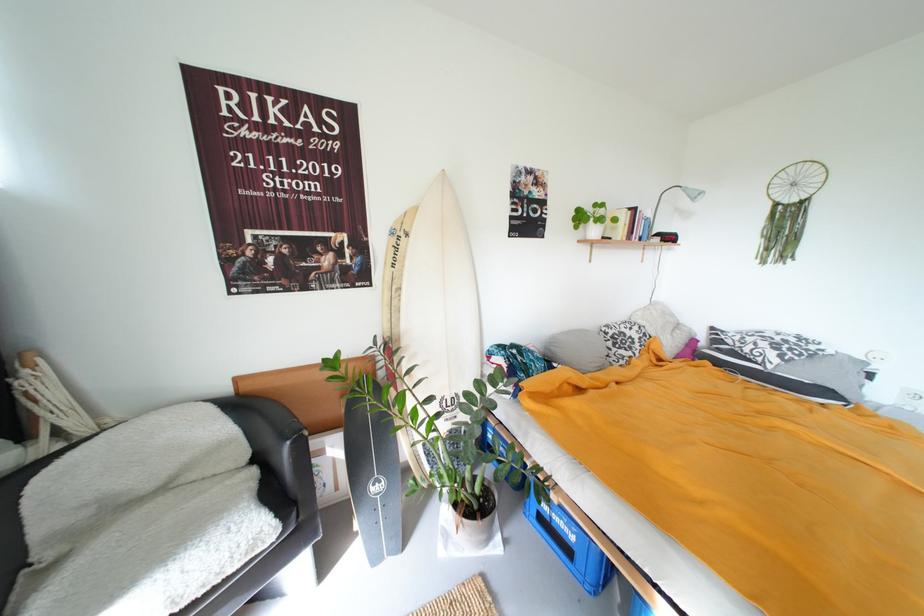
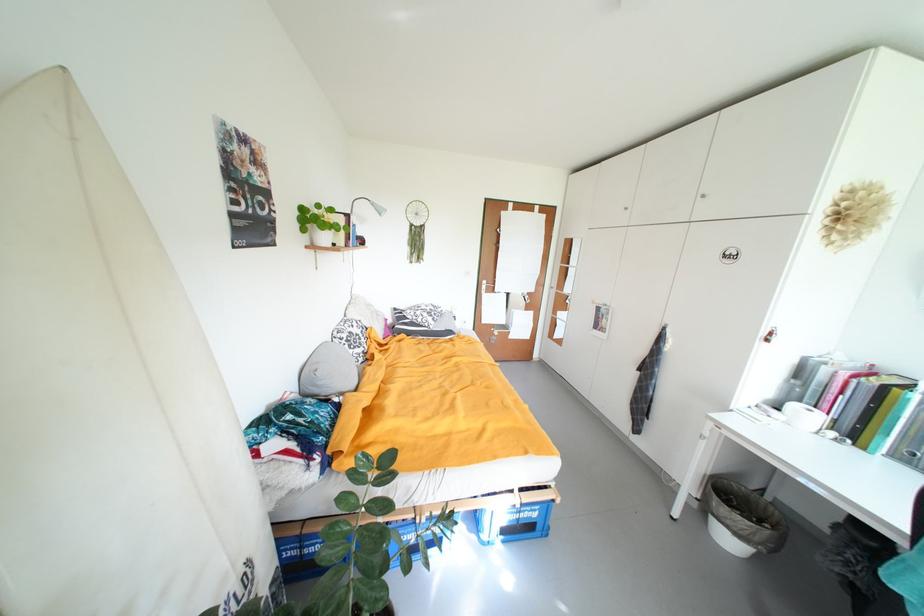
Find the pixel in the second image that matches [693,192] in the first image.

(381, 206)